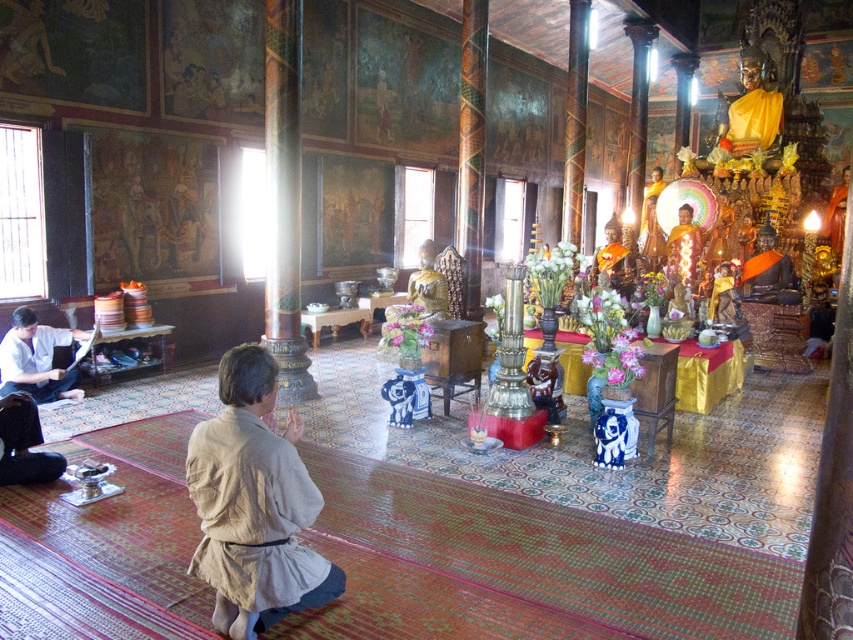
Question: Is beige linen robe at lower center below white paper at left?

Choices:
 (A) yes
 (B) no

Answer: (A)

Question: Where is beige linen robe at lower center located in relation to white paper at left in the image?

Choices:
 (A) left
 (B) right

Answer: (B)

Question: Does beige linen robe at lower center appear on the right side of white paper at left?

Choices:
 (A) yes
 (B) no

Answer: (A)

Question: Which of the following is the closest to the observer?

Choices:
 (A) beige linen robe at lower center
 (B) white paper at left

Answer: (A)

Question: Which point appears farthest from the camera in this image?

Choices:
 (A) (312, 593)
 (B) (13, 390)

Answer: (B)

Question: Which object is farther from the camera taking this photo?

Choices:
 (A) beige linen robe at lower center
 (B) white paper at left

Answer: (B)